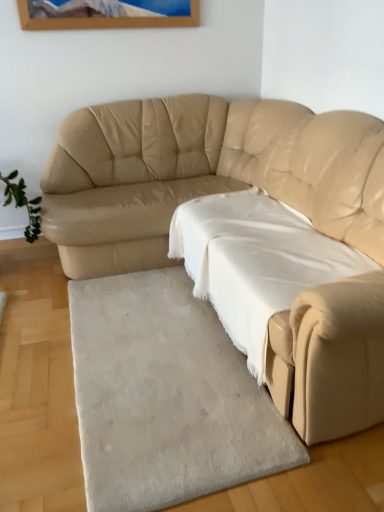
I want to click on beige leather couch at center, so click(204, 174).

Find the location of `beige leather couch at center`. beige leather couch at center is located at coordinates (204, 174).

Considering the relative positions of white soft rug at lower center and beige leather couch at center in the image provided, is white soft rug at lower center to the left of beige leather couch at center from the viewer's perspective?

Correct, you'll find white soft rug at lower center to the left of beige leather couch at center.

From the image's perspective, is white soft rug at lower center above or below beige leather couch at center?

Clearly, from the image's perspective, white soft rug at lower center is below beige leather couch at center.

Considering the sizes of objects white soft rug at lower center and beige leather couch at center in the image provided, who is thinner, white soft rug at lower center or beige leather couch at center?

white soft rug at lower center is thinner.

Where is `studio couch on the right of white soft rug at lower center`? studio couch on the right of white soft rug at lower center is located at coordinates (204, 174).

Can white soft rug at lower center be found inside white cotton sheet at center?

That's incorrect, white soft rug at lower center is not inside white cotton sheet at center.

The width and height of the screenshot is (384, 512). I want to click on mat below the white cotton sheet at center (from a real-world perspective), so click(x=166, y=396).

Based on the photo, can you tell me how much white cotton sheet at center and white soft rug at lower center differ in facing direction?

1.9 degrees separate the facing orientations of white cotton sheet at center and white soft rug at lower center.

Is white cotton sheet at center facing away from white soft rug at lower center?

No, white cotton sheet at center is not facing the opposite direction of white soft rug at lower center.

There is a white cotton sheet at center. Where is `studio couch above it (from a real-world perspective)`? studio couch above it (from a real-world perspective) is located at coordinates (204, 174).

In terms of height, does white cotton sheet at center look taller or shorter compared to beige leather couch at center?

Considering their sizes, white cotton sheet at center has less height than beige leather couch at center.

Is white cotton sheet at center oriented away from beige leather couch at center?

Yes, beige leather couch at center is at the back of white cotton sheet at center.

Looking at this image, who is shorter, white soft rug at lower center or white cotton sheet at center?

white soft rug at lower center is shorter.

Identify the location of mat below the white cotton sheet at center (from a real-world perspective). The image size is (384, 512). (166, 396).

Is white soft rug at lower center facing away from white cotton sheet at center?

No, white cotton sheet at center is not at the back of white soft rug at lower center.

From the picture: From a real-world perspective, which object rests below the other?

white soft rug at lower center is physically lower.

Is beige leather couch at center facing away from white soft rug at lower center?

No, beige leather couch at center is not facing away from white soft rug at lower center.

From the image's perspective, which is below, beige leather couch at center or white soft rug at lower center?

white soft rug at lower center is shown below in the image.

Is white cotton sheet at center at the back of beige leather couch at center?

Yes, beige leather couch at center's orientation is away from white cotton sheet at center.

Is point (42, 220) closer to camera compared to point (253, 338)?

No, (42, 220) is further to viewer.

Is beige leather couch at center to the left or to the right of white cotton sheet at center in the image?

From the image, it's evident that beige leather couch at center is to the left of white cotton sheet at center.

From the image's perspective, who appears lower, beige leather couch at center or white cotton sheet at center?

white cotton sheet at center, from the image's perspective.

Locate an element on the screen. This screenshot has width=384, height=512. mat behind the beige leather couch at center is located at coordinates (166, 396).

Find the location of a particular element. This screenshot has width=384, height=512. sheet that appears above the white soft rug at lower center (from a real-world perspective) is located at coordinates (255, 262).

Looking at the image, which one is located closer to beige leather couch at center, white soft rug at lower center or white cotton sheet at center?

white cotton sheet at center.

When comparing their distances from white cotton sheet at center, does white soft rug at lower center or beige leather couch at center seem closer?

beige leather couch at center is positioned closer to the anchor white cotton sheet at center.

From the image, which object appears to be nearer to white soft rug at lower center, beige leather couch at center or white cotton sheet at center?

white cotton sheet at center is positioned closer to the anchor white soft rug at lower center.

Considering their positions, is beige leather couch at center positioned further to white cotton sheet at center than white soft rug at lower center?

Based on the image, white soft rug at lower center appears to be further to white cotton sheet at center.

Based on their spatial positions, is white cotton sheet at center or white soft rug at lower center further from beige leather couch at center?

Based on the image, white soft rug at lower center appears to be further to beige leather couch at center.

When comparing their distances from white soft rug at lower center, does white cotton sheet at center or beige leather couch at center seem further?

beige leather couch at center is positioned further to the anchor white soft rug at lower center.

Identify the location of sheet that lies between beige leather couch at center and white soft rug at lower center from top to bottom. (255, 262).